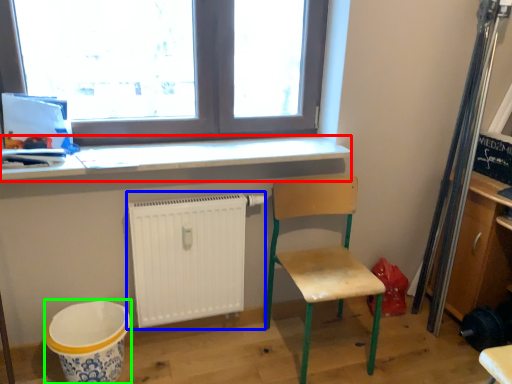
Question: Which object is positioned closest to counter top (highlighted by a red box)? Select from radiator (highlighted by a blue box) and mixing bowl (highlighted by a green box).

Choices:
 (A) radiator
 (B) mixing bowl

Answer: (A)